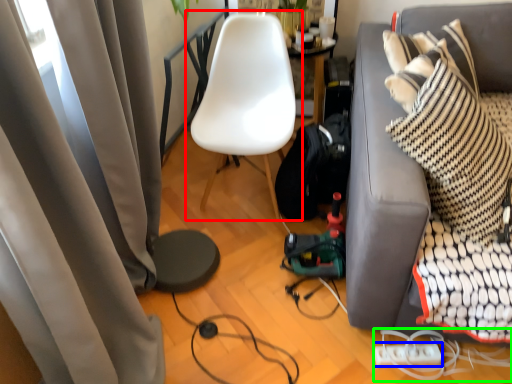
Question: Based on their relative distances, which object is nearer to chair (highlighted by a red box)? Choose from extension cord (highlighted by a blue box) and cable (highlighted by a green box).

Choices:
 (A) extension cord
 (B) cable

Answer: (B)